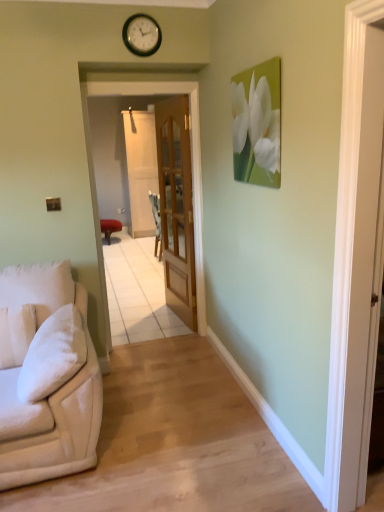
Question: From the image's perspective, is matte red stool at center located beneath beige fabric couch at left?

Choices:
 (A) no
 (B) yes

Answer: (A)

Question: Is beige fabric couch at left completely or partially inside matte red stool at center?

Choices:
 (A) yes
 (B) no

Answer: (B)

Question: Does matte red stool at center come in front of beige fabric couch at left?

Choices:
 (A) yes
 (B) no

Answer: (B)

Question: From the image's perspective, is matte red stool at center above beige fabric couch at left?

Choices:
 (A) no
 (B) yes

Answer: (B)

Question: Is matte red stool at center outside beige fabric couch at left?

Choices:
 (A) yes
 (B) no

Answer: (A)

Question: From a real-world perspective, is metallic gold clock at upper center physically located above or below clear glass door at center, which is the 1th screen door in front-to-back order?

Choices:
 (A) above
 (B) below

Answer: (A)

Question: In terms of width, does metallic gold clock at upper center look wider or thinner when compared to clear glass door at center, which is the second screen door from back to front?

Choices:
 (A) thin
 (B) wide

Answer: (A)

Question: Choose the correct answer: Is metallic gold clock at upper center inside clear glass door at center, which is the 1th screen door in front-to-back order, or outside it?

Choices:
 (A) outside
 (B) inside

Answer: (A)

Question: Is point (132, 31) positioned closer to the camera than point (117, 92)?

Choices:
 (A) closer
 (B) farther

Answer: (A)

Question: From a real-world perspective, is matte red stool at center physically located above or below beige fabric couch at left?

Choices:
 (A) above
 (B) below

Answer: (B)

Question: Is matte red stool at center in front of or behind beige fabric couch at left in the image?

Choices:
 (A) behind
 (B) front

Answer: (A)

Question: Which is correct: matte red stool at center is inside beige fabric couch at left, or outside of it?

Choices:
 (A) outside
 (B) inside

Answer: (A)

Question: Considering the positions of matte red stool at center and beige fabric couch at left in the image, is matte red stool at center bigger or smaller than beige fabric couch at left?

Choices:
 (A) big
 (B) small

Answer: (A)

Question: Is point (6, 336) closer or farther from the camera than point (135, 30)?

Choices:
 (A) farther
 (B) closer

Answer: (B)

Question: From the image's perspective, is white soft pillow at left positioned above or below metallic gold clock at upper center?

Choices:
 (A) below
 (B) above

Answer: (A)